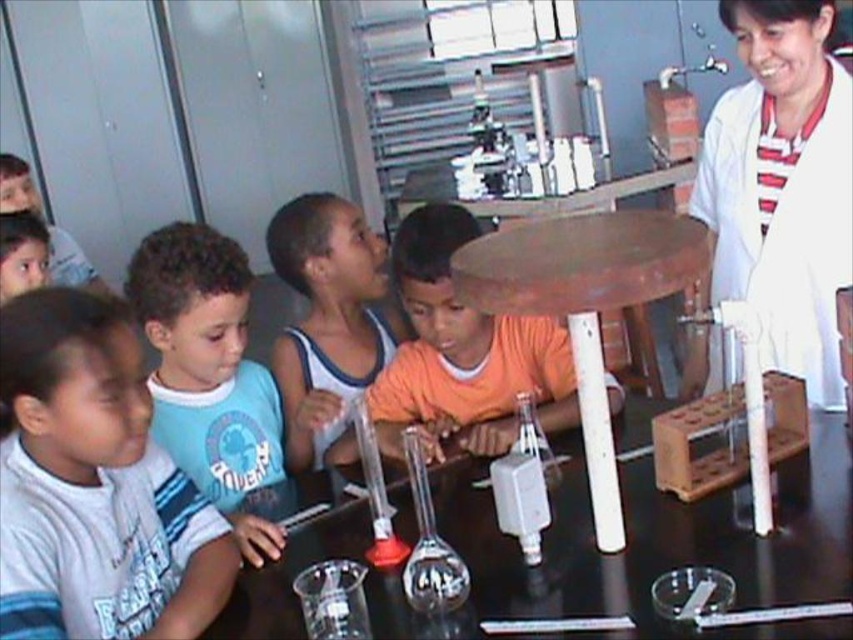
Question: Considering the relative positions of blue cotton shirt at center and orange matte shirt at center in the image provided, where is blue cotton shirt at center located with respect to orange matte shirt at center?

Choices:
 (A) left
 (B) right

Answer: (A)

Question: Among these objects, which one is farthest from the camera?

Choices:
 (A) transparent glass table at center
 (B) white lab coat at upper right
 (C) blue cotton shirt at center

Answer: (B)

Question: Is white lab coat at upper right to the left of orange matte shirt at center from the viewer's perspective?

Choices:
 (A) no
 (B) yes

Answer: (A)

Question: Which point is farther from the camera taking this photo?

Choices:
 (A) (631, 218)
 (B) (88, 401)

Answer: (A)

Question: Where is orange matte shirt at center located in relation to brown wooden table at center in the image?

Choices:
 (A) right
 (B) left

Answer: (B)

Question: Among these objects, which one is nearest to the camera?

Choices:
 (A) blue cotton shirt at center
 (B) white lab coat at upper right

Answer: (A)